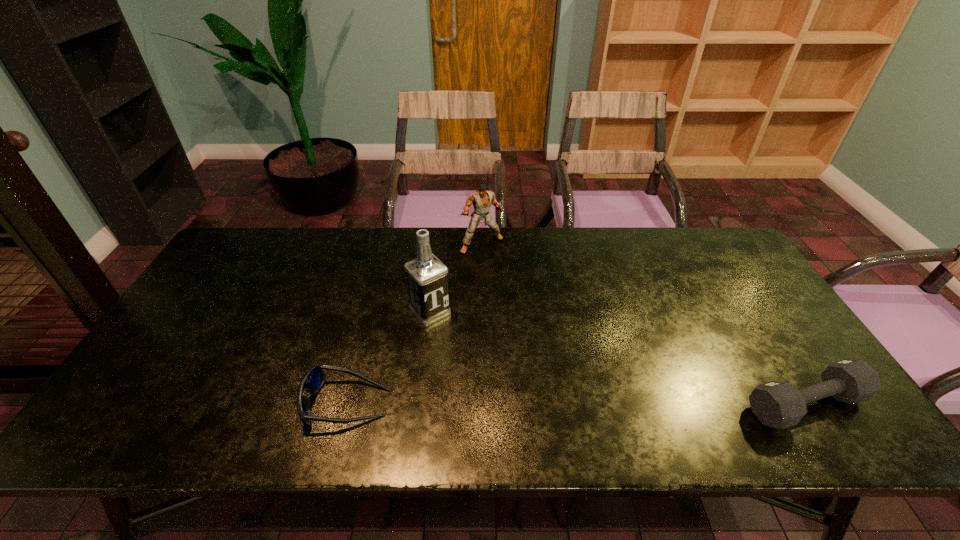
What are the coordinates of `empty location between the third tallest object and the leftmost object` in the screenshot? It's located at (576, 403).

The image size is (960, 540). Find the location of `empty space between the third tallest object and the second tallest object`. empty space between the third tallest object and the second tallest object is located at coordinates (643, 324).

Identify the location of empty location between the second object from right to left and the leftmost object. (415, 323).

The height and width of the screenshot is (540, 960). I want to click on vacant space that is in between the leftmost object and the second tallest object, so click(x=415, y=323).

This screenshot has width=960, height=540. What are the coordinates of `free space between the farthest object and the second object from left to right` in the screenshot? It's located at (456, 278).

Locate an element on the screen. Image resolution: width=960 pixels, height=540 pixels. vacant area that lies between the farthest object and the shortest object is located at coordinates (415, 323).

The image size is (960, 540). I want to click on vacant area between the dumbbell and the vodka, so pos(618,358).

Identify the location of free space between the shortest object and the vodka. The height and width of the screenshot is (540, 960). (389, 357).

Where is `empty location between the vodka and the second object from right to left`? The height and width of the screenshot is (540, 960). empty location between the vodka and the second object from right to left is located at coordinates (456, 278).

Select which object appears as the second closest to the vodka. Please provide its 2D coordinates. Your answer should be formatted as a tuple, i.e. [(x, y)], where the tuple contains the x and y coordinates of a point satisfying the conditions above.

[(481, 199)]